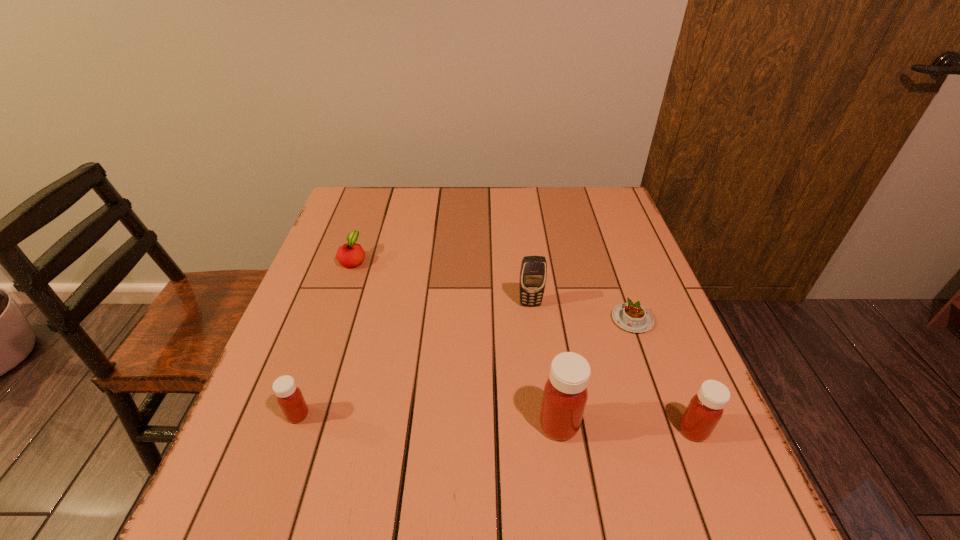
Identify the location of blank space located on the back of the leftmost medicine. (318, 356).

You are a GUI agent. You are given a task and a screenshot of the screen. Output one action in this format:
    pyautogui.click(x=<x>, y=<y>)
    Task: Click on the vacant space located 0.200m on the left of the second medicine from left to right
    The height and width of the screenshot is (540, 960).
    Given the screenshot: What is the action you would take?
    pyautogui.click(x=433, y=425)

Identify the location of vacant space located on the back of the third tallest object. (645, 309).

This screenshot has width=960, height=540. Find the location of `free region located 0.380m on the front face of the cellular telephone`. free region located 0.380m on the front face of the cellular telephone is located at coordinates (549, 460).

Where is `vacant space located 0.340m on the front of the fifth tallest object`? vacant space located 0.340m on the front of the fifth tallest object is located at coordinates coord(313,377).

Find the location of `free region located 0.330m on the left of the pudding`. free region located 0.330m on the left of the pudding is located at coordinates (471, 320).

This screenshot has width=960, height=540. Identify the location of medicine that is at the left edge. (289, 397).

The height and width of the screenshot is (540, 960). I want to click on apple at the left edge, so click(351, 254).

You are a GUI agent. You are given a task and a screenshot of the screen. Output one action in this format:
    pyautogui.click(x=<x>, y=<y>)
    Task: Click on the medicine that is at the right edge
    This screenshot has height=540, width=960.
    Given the screenshot: What is the action you would take?
    pyautogui.click(x=705, y=409)

What are the coordinates of `pudding that is at the right edge` in the screenshot? It's located at (632, 317).